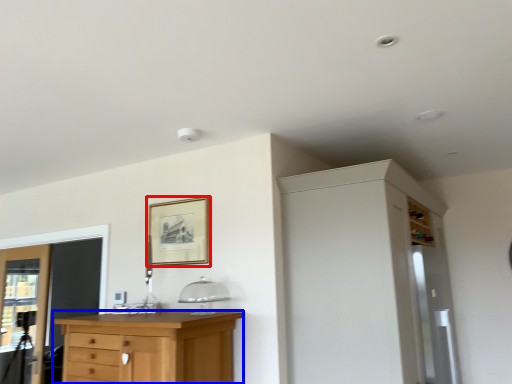
Question: Which object is closer to the camera taking this photo, picture frame (highlighted by a red box) or chest of drawers (highlighted by a blue box)?

Choices:
 (A) picture frame
 (B) chest of drawers

Answer: (B)